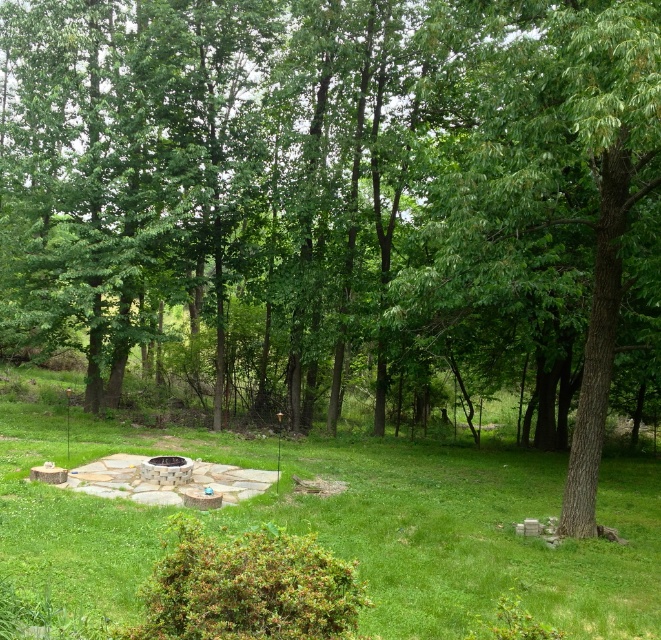
In the scene shown: You are standing in the backyard and want to place a small garden statue. The statue requires a flat, open space on the green grassy at center. Based on the scene description, is the area at point (x=469, y=532) suitable for placing the statue?

The point (x=469, y=532) indicates green grassy at center, which is a flat and open area suitable for placing the small garden statue.

You are planning to set up a picnic blanket in the backyard. The picnic blanket is 2 meters wide. You see the green grassy at center and the green rough bark tree at center. Which area is wider, and can the picnic blanket fit there?

The green grassy at center is wider than the green rough bark tree at center. Since the picnic blanket is 2 meters wide, it can fit in the green grassy at center if its width is at least 2 meters. However, the exact width of the grassy area isn

You are standing in the backyard and want to walk from the green grassy at center to the green rough bark tree at center. Which direction should you move towards?

You should move towards the right because the green grassy at center is to the left of the green rough bark tree at center, so moving right will lead you towards the tree.